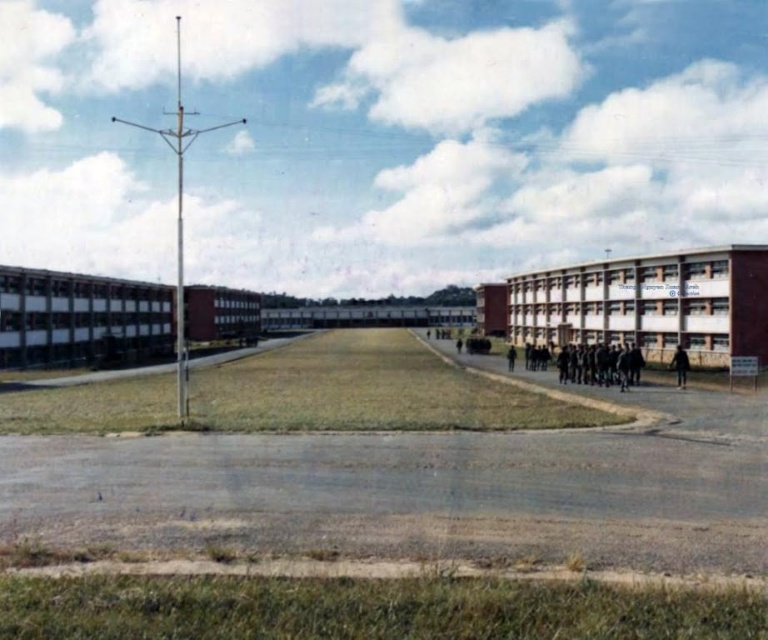
Question: From the image, what is the correct spatial relationship of white matte building at center-right in relation to white matte building at left?

Choices:
 (A) right
 (B) left

Answer: (A)

Question: Among these objects, which one is farthest from the camera?

Choices:
 (A) white matte building at center-right
 (B) white matte building at left

Answer: (B)

Question: In this image, where is black matte person at lower right located relative to black matte person at center?

Choices:
 (A) below
 (B) above

Answer: (B)

Question: Can you confirm if black matte person at lower right is positioned below black matte person at center?

Choices:
 (A) no
 (B) yes

Answer: (A)

Question: Which of the following is the closest to the observer?

Choices:
 (A) black matte person at lower right
 (B) black matte person at center
 (C) white matte building at left

Answer: (A)

Question: Which object appears closest to the camera in this image?

Choices:
 (A) black uniform at center
 (B) black matte person at lower right
 (C) white matte building at left
 (D) black matte person at center

Answer: (B)